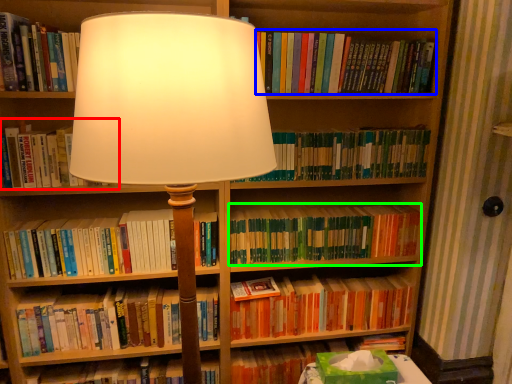
Question: Which object is positioned closest to book (highlighted by a red box)? Select from book (highlighted by a blue box) and book (highlighted by a green box).

Choices:
 (A) book
 (B) book

Answer: (B)